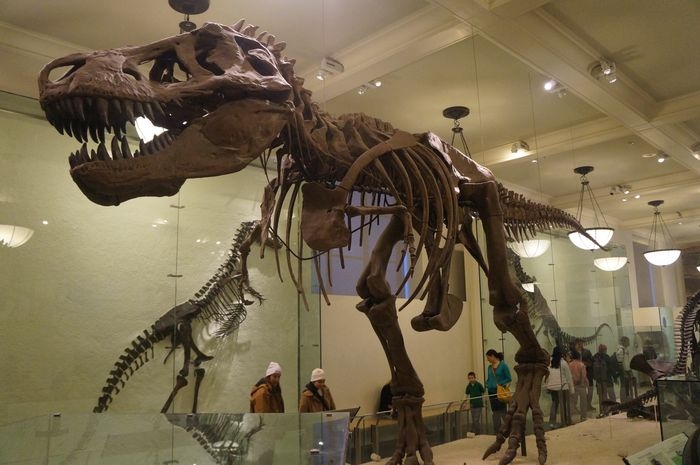
Where is `ceiling`? The image size is (700, 465). ceiling is located at coordinates (476, 86).